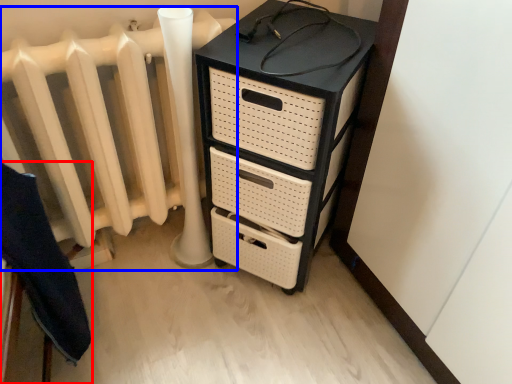
Question: Which of the following is the farthest to the observer, furniture (highlighted by a red box) or radiator (highlighted by a blue box)?

Choices:
 (A) furniture
 (B) radiator

Answer: (B)